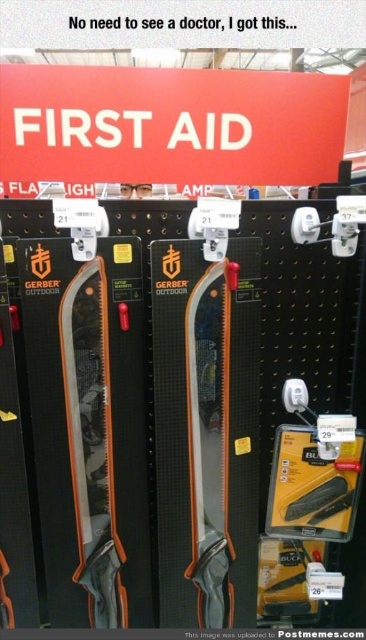
You are a customer in a store looking at the first aid shelf. You need to place a 12 inch long box between the matte black saw at center and the orange plastic saw at center. Is there enough space?

The matte black saw at center and orange plastic saw at center are 11.06 inches apart. Since the box is 12 inches long, there isn not enough space between them to fit the box.

You are a customer looking to buy a saw. You see the matte black saw at center and the orange plastic saw at center on the shelf. Which one is located to the left?

The matte black saw at center is positioned on the left side of orange plastic saw at center, so the matte black saw at center is located to the left.